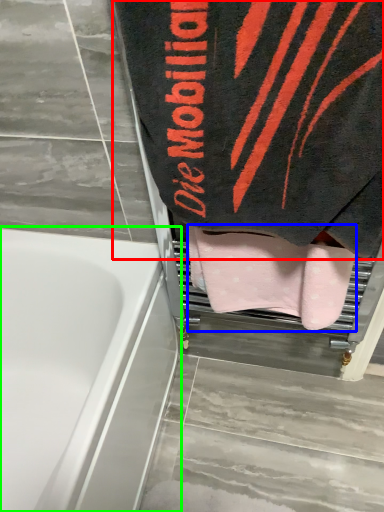
Question: Considering the real-world distances, which object is farthest from towel (highlighted by a red box)? towel (highlighted by a blue box) or bathtub (highlighted by a green box)?

Choices:
 (A) towel
 (B) bathtub

Answer: (B)